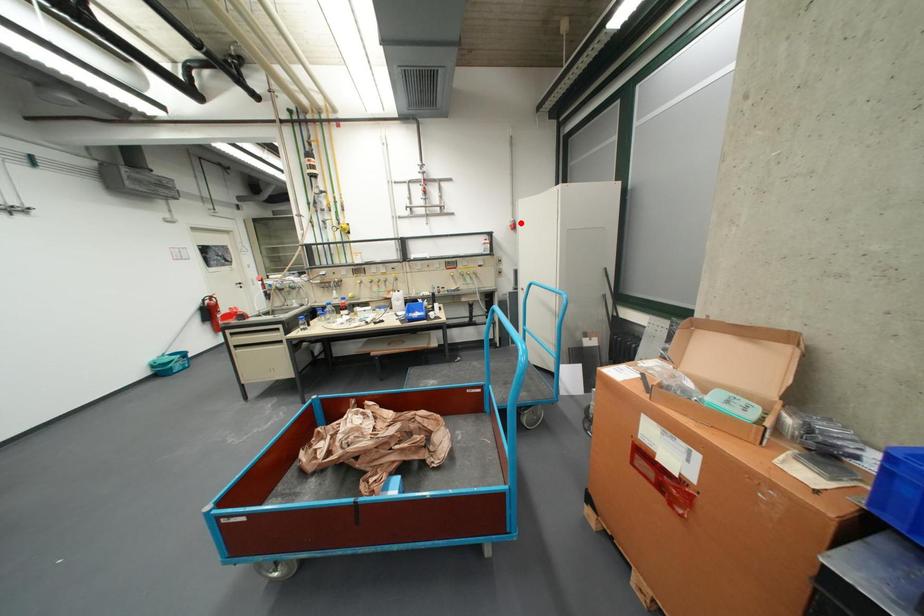
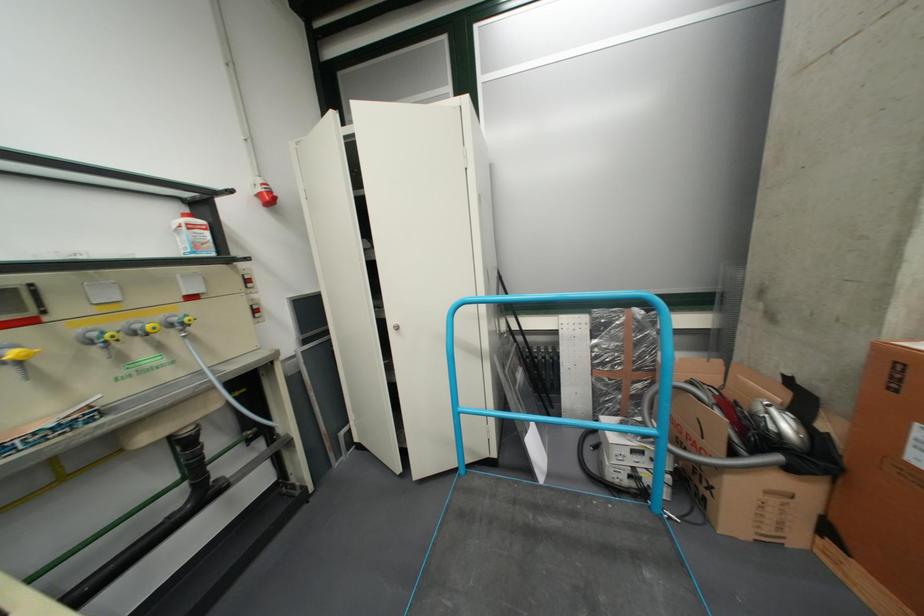
Where in the second image is the point corresponding to the highlighted location from the first image?

(260, 185)